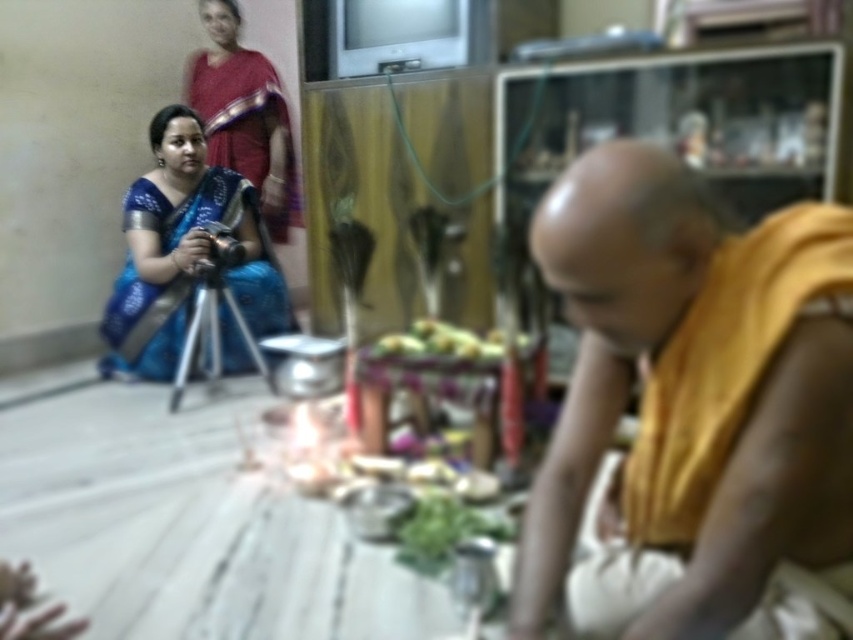
Based on the scene description, if you were standing facing the yellow clothed monk at center and the yellowish matte fruit at center, which object would be on your left?

The yellowish matte fruit at center is on the left side of the yellow clothed monk at center, so if you are facing them, the yellowish matte fruit at center would be to your left.

You are standing in the domestic setting described. There is a point marked at coordinates (694,406). What object or person is located at that point?

Result: The point at coordinates (694,406) marks the yellow clothed monk at center.

Based on the scene description, can you determine the spatial relationship between the yellow clothed monk at center and the yellowish matte fruit at center? Please state which one is positioned higher in the image.

The yellow clothed monk at center is located below the yellowish matte fruit at center, so the fruit is higher up in the image.